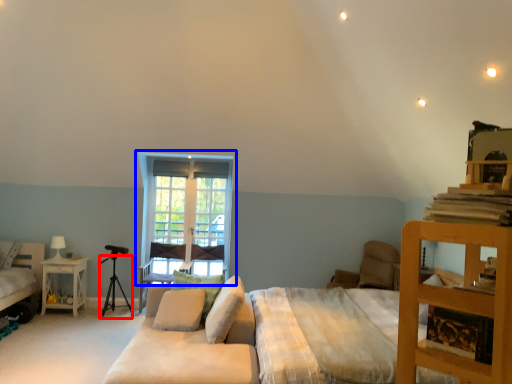
Question: Which object is further to the camera taking this photo, tripod (highlighted by a red box) or window (highlighted by a blue box)?

Choices:
 (A) tripod
 (B) window

Answer: (B)